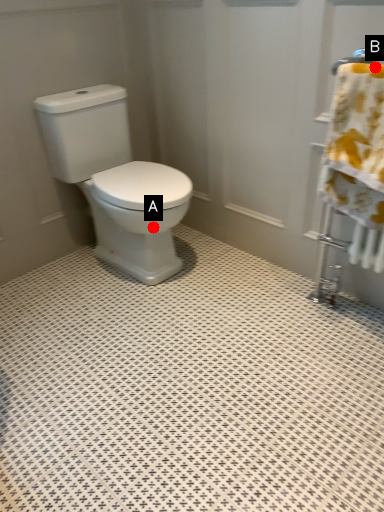
Question: Two points are circled on the image, labeled by A and B beside each circle. Which point is further to the camera?

Choices:
 (A) A is further
 (B) B is further

Answer: (A)